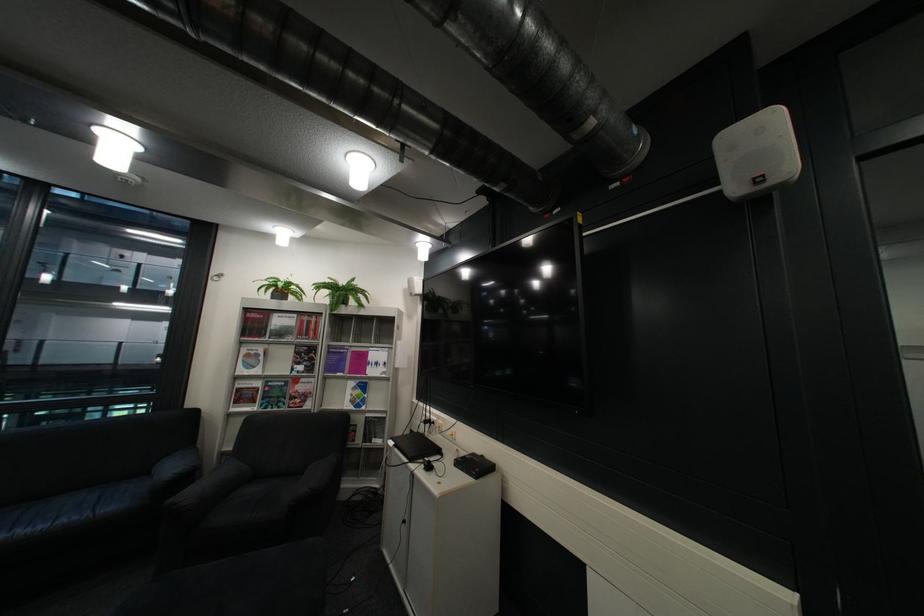
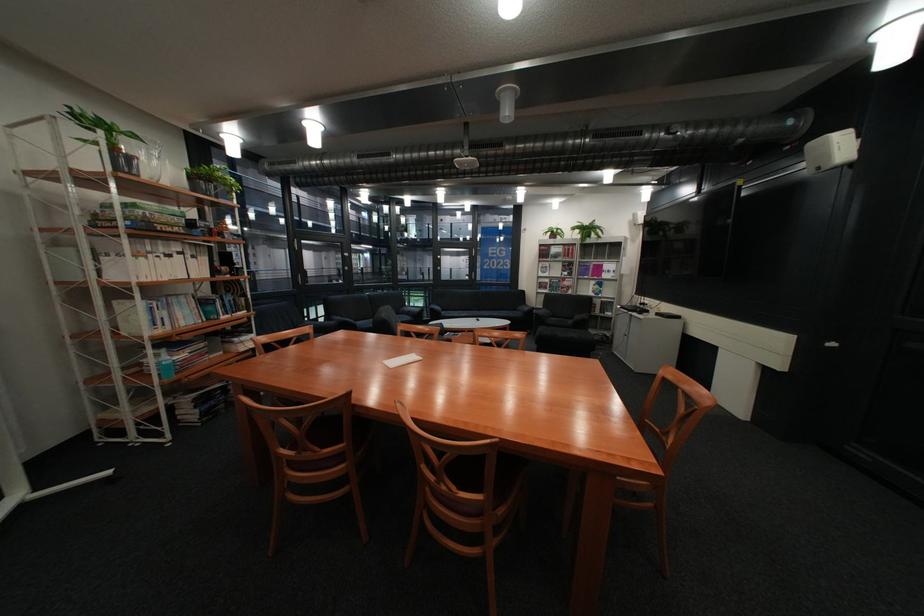
Find the pixel in the second image that matches [347,283] in the first image.

(594, 225)